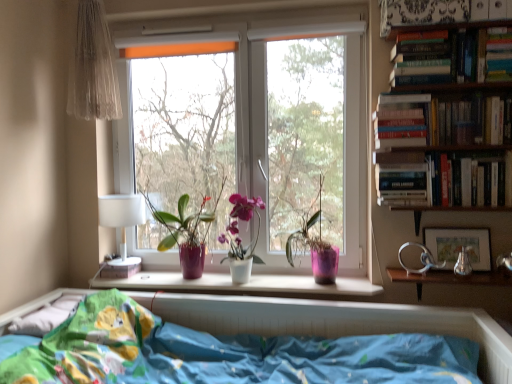
At what (x,y) coordinates should I click in order to perform the action: click on free space above hardcover book at upper right, which appears as the first book when ordered from the bottom (from a real-world perspective). Please return your answer as a coordinate pair (x, y). Looking at the image, I should click on (468, 150).